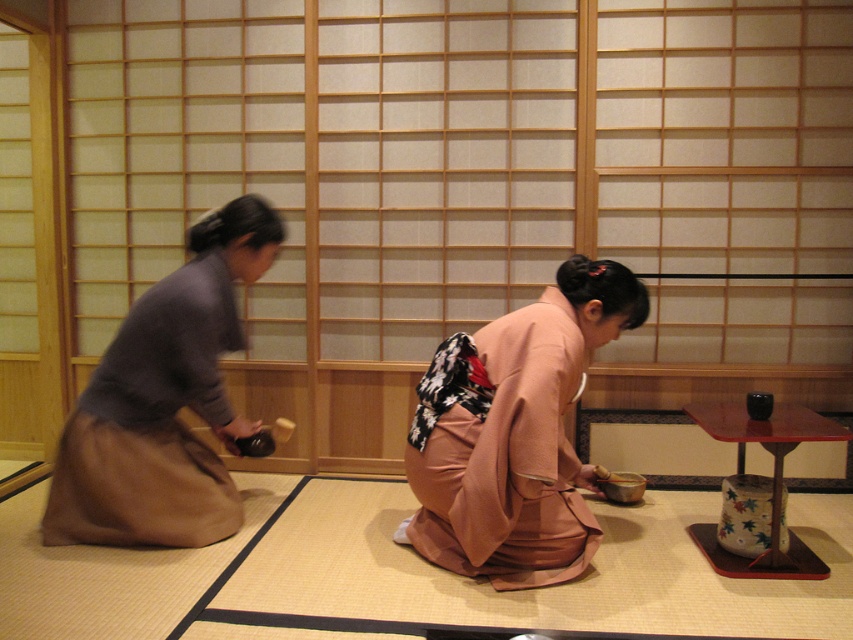
Question: Which point is closer to the camera taking this photo?

Choices:
 (A) (585, 484)
 (B) (184, 486)

Answer: (B)

Question: Is pink silk kimono at center in front of matte brown skirt at left?

Choices:
 (A) no
 (B) yes

Answer: (B)

Question: Which point is farther to the camera?

Choices:
 (A) matte brown skirt at left
 (B) pink silk kimono at center

Answer: (A)

Question: Is pink silk kimono at center above matte brown skirt at left?

Choices:
 (A) yes
 (B) no

Answer: (B)

Question: Is pink silk kimono at center further to camera compared to matte brown skirt at left?

Choices:
 (A) yes
 (B) no

Answer: (B)